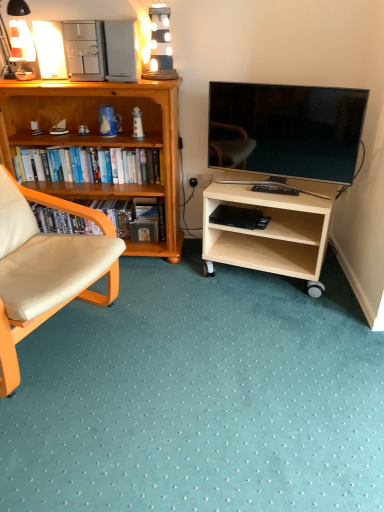
Question: Should I look upward or downward to see hardcover books at left, the first book viewed from the top?

Choices:
 (A) down
 (B) up

Answer: (B)

Question: Considering the relative sizes of wooden bookshelf at left, which appears as the first desk when viewed from the left, and light wood/finished wood tv stand at lower right, which ranks as the first desk in right-to-left order, in the image provided, is wooden bookshelf at left, which appears as the first desk when viewed from the left, smaller than light wood/finished wood tv stand at lower right, which ranks as the first desk in right-to-left order,?

Choices:
 (A) no
 (B) yes

Answer: (A)

Question: Considering the relative positions of wooden bookshelf at left, positioned as the 2th desk in right-to-left order, and light wood/finished wood tv stand at lower right, which ranks as the first desk in right-to-left order, in the image provided, is wooden bookshelf at left, positioned as the 2th desk in right-to-left order, to the right of light wood/finished wood tv stand at lower right, which ranks as the first desk in right-to-left order, from the viewer's perspective?

Choices:
 (A) yes
 (B) no

Answer: (B)

Question: Considering the relative sizes of wooden bookshelf at left, positioned as the 2th desk in right-to-left order, and light wood/finished wood tv stand at lower right, the second desk viewed from the left, in the image provided, is wooden bookshelf at left, positioned as the 2th desk in right-to-left order, bigger than light wood/finished wood tv stand at lower right, the second desk viewed from the left,?

Choices:
 (A) yes
 (B) no

Answer: (A)

Question: Is wooden bookshelf at left, positioned as the 2th desk in right-to-left order, wider than light wood/finished wood tv stand at lower right, which ranks as the first desk in right-to-left order?

Choices:
 (A) no
 (B) yes

Answer: (A)

Question: Is wooden bookshelf at left, which appears as the first desk when viewed from the left, shorter than light wood/finished wood tv stand at lower right, the second desk viewed from the left?

Choices:
 (A) yes
 (B) no

Answer: (B)

Question: Considering the relative positions of wooden bookshelf at left, which appears as the first desk when viewed from the left, and light wood/finished wood tv stand at lower right, which ranks as the first desk in right-to-left order, in the image provided, is wooden bookshelf at left, which appears as the first desk when viewed from the left, to the left of light wood/finished wood tv stand at lower right, which ranks as the first desk in right-to-left order, from the viewer's perspective?

Choices:
 (A) no
 (B) yes

Answer: (B)

Question: Is matte white lamp at upper left turned away from hardcover books at left, the first book viewed from the top?

Choices:
 (A) no
 (B) yes

Answer: (A)

Question: Is matte white lamp at upper left positioned in front of hardcover books at left, which ranks as the 2th book in bottom-to-top order?

Choices:
 (A) no
 (B) yes

Answer: (B)

Question: Can you confirm if matte white lamp at upper left is taller than hardcover books at left, the first book viewed from the top?

Choices:
 (A) no
 (B) yes

Answer: (B)

Question: Is matte white lamp at upper left wider than hardcover books at left, the first book viewed from the top?

Choices:
 (A) yes
 (B) no

Answer: (A)

Question: Is matte white lamp at upper left positioned beyond the bounds of hardcover books at left, which ranks as the 2th book in bottom-to-top order?

Choices:
 (A) no
 (B) yes

Answer: (B)

Question: Does matte white lamp at upper left touch hardcover books at left, which ranks as the 2th book in bottom-to-top order?

Choices:
 (A) yes
 (B) no

Answer: (B)

Question: Does hardcover books at left, which ranks as the 2th book in bottom-to-top order, have a greater height compared to matte black tv at right?

Choices:
 (A) no
 (B) yes

Answer: (A)